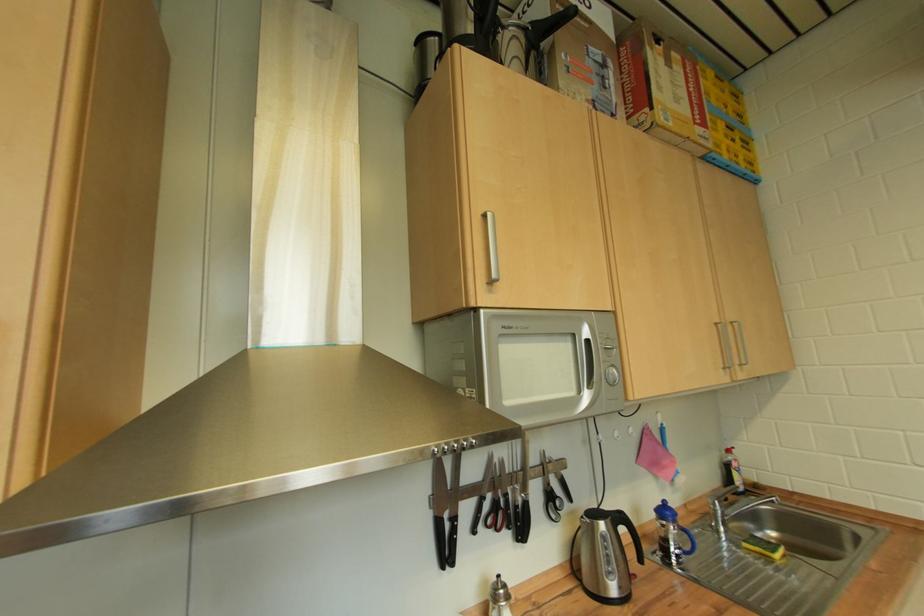
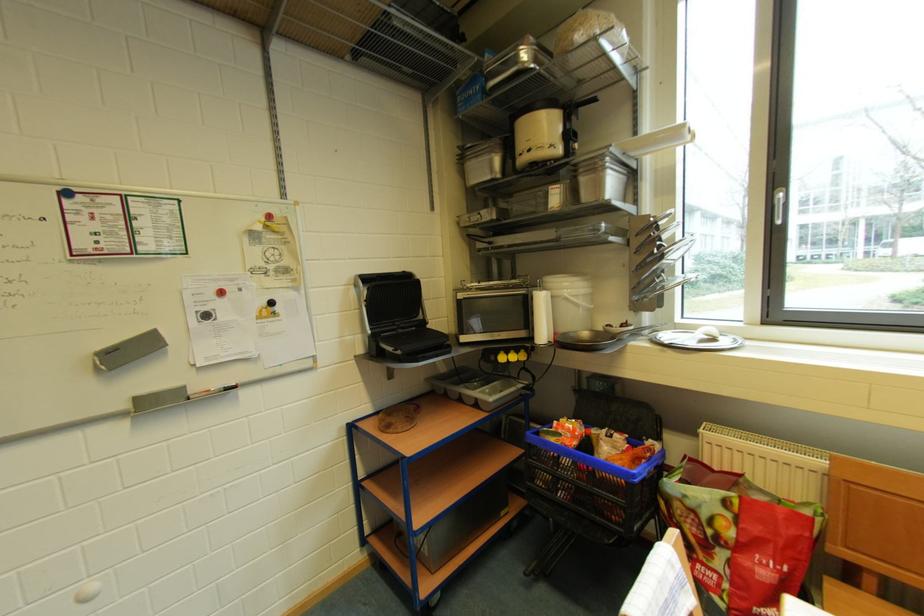
Question: The camera is either moving clockwise (left) or counter-clockwise (right) around the object. The first image is from the beginning of the video and the second image is from the end. Is the camera moving left or right when shooting the video?

Choices:
 (A) Left
 (B) Right

Answer: (A)